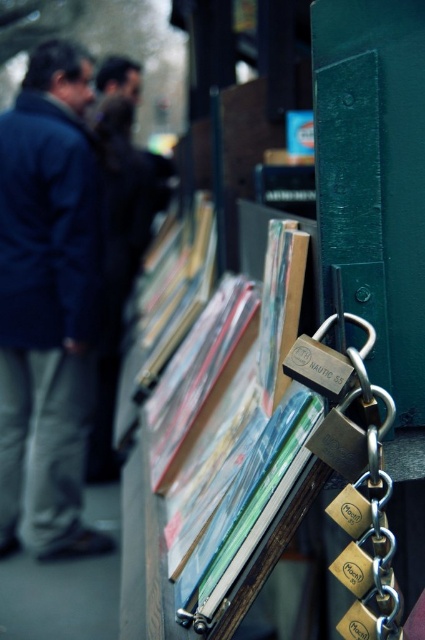
Does dark blue jacket at left have a greater height compared to matte plastic books at center?

Indeed, dark blue jacket at left has a greater height compared to matte plastic books at center.

Is dark blue jacket at left to the right of matte plastic books at center from the viewer's perspective?

In fact, dark blue jacket at left is to the left of matte plastic books at center.

Is point (22, 252) closer to viewer compared to point (288, 387)?

No.

You are a GUI agent. You are given a task and a screenshot of the screen. Output one action in this format:
    pyautogui.click(x=<x>, y=<y>)
    Task: Click on the dark blue jacket at left
    This screenshot has height=640, width=425.
    Given the screenshot: What is the action you would take?
    pyautogui.click(x=48, y=305)